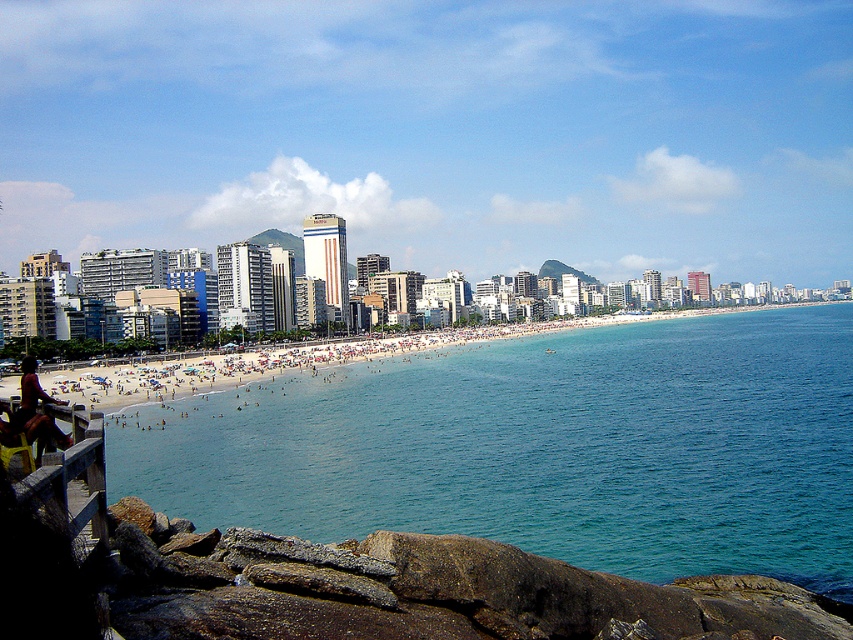
Does clear blue water at center appear on the right side of matte black surfboard at lower left?

Indeed, clear blue water at center is positioned on the right side of matte black surfboard at lower left.

Which is below, clear blue water at center or matte black surfboard at lower left?

clear blue water at center is lower down.

Which is behind, point (334, 372) or point (51, 420)?

Positioned behind is point (334, 372).

Where is `clear blue water at center`? This screenshot has width=853, height=640. clear blue water at center is located at coordinates (541, 448).

Which is below, clear blue water at center or beach sand at center?

clear blue water at center is lower down.

Describe the element at coordinates (541, 448) in the screenshot. The height and width of the screenshot is (640, 853). I see `clear blue water at center` at that location.

Find the location of `clear blue water at center`. clear blue water at center is located at coordinates (541, 448).

Is beach sand at center smaller than wooden rail at lower left?

Actually, beach sand at center might be larger than wooden rail at lower left.

Between beach sand at center and wooden rail at lower left, which one has more height?

beach sand at center is taller.

Where is `beach sand at center`? The image size is (853, 640). beach sand at center is located at coordinates (325, 358).